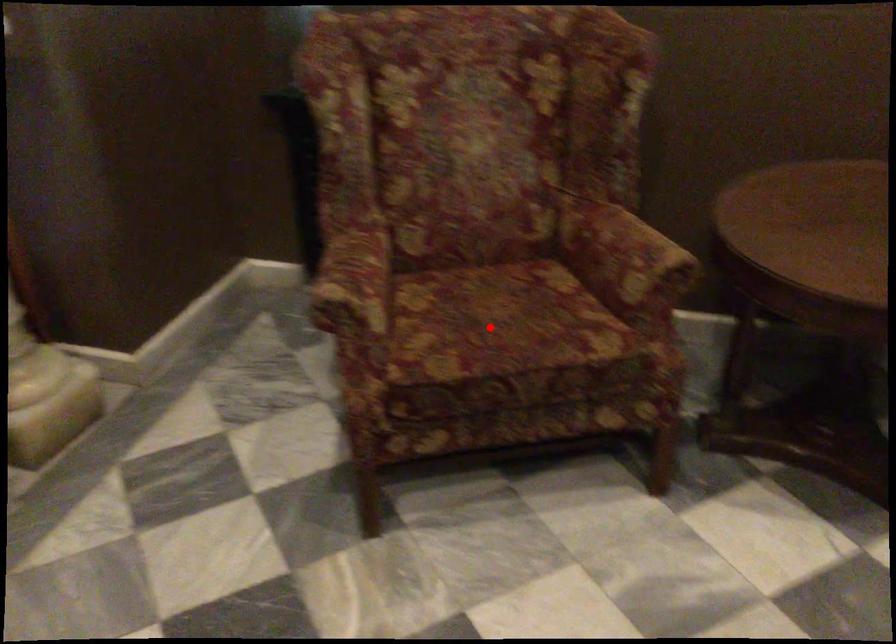
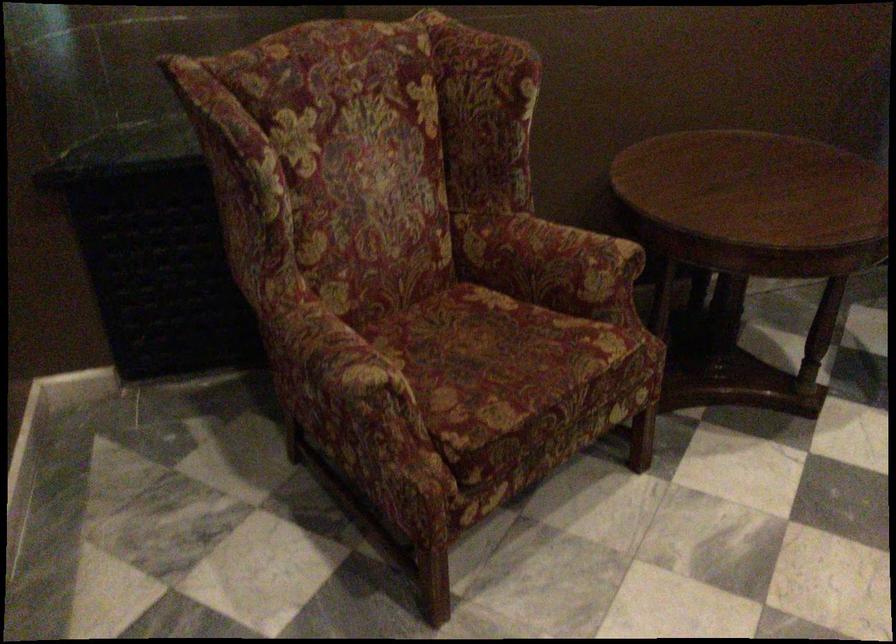
Where in the second image is the point corresponding to the highlighted location from the first image?

(495, 363)